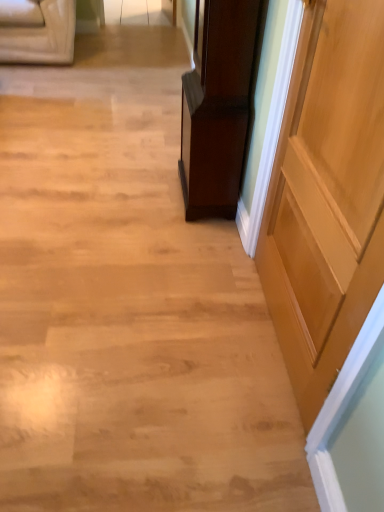
The image size is (384, 512). Find the location of `vacant space that is to the left of light brown wood door at right`. vacant space that is to the left of light brown wood door at right is located at coordinates [x=164, y=327].